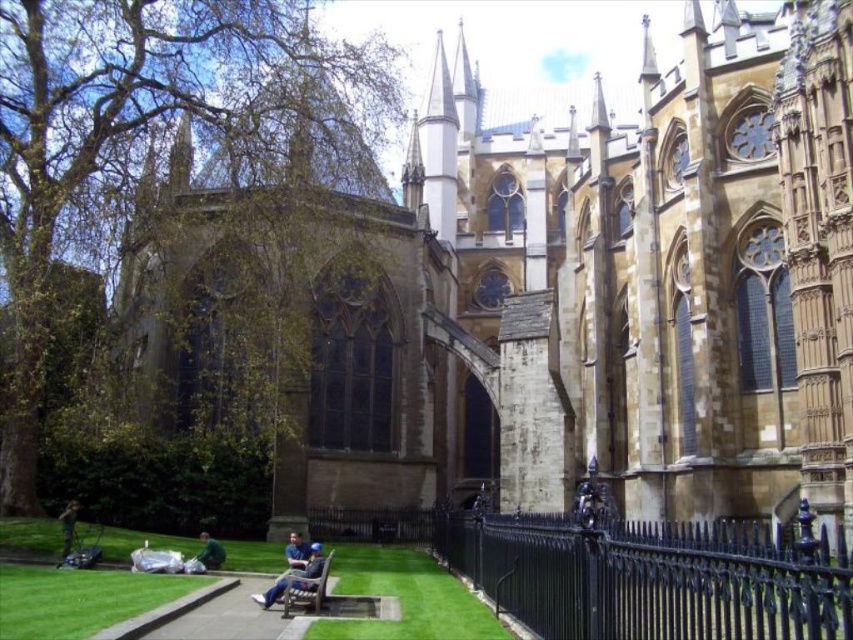
You are a visitor standing at the entrance of the historic Gothic building and want to take a photo of the black wrought iron fence at lower right and the wooden bench at center. Which object is taller in the image?

The black wrought iron fence at lower right is taller than the wooden bench at center.

You are standing at the entrance of the historic Gothic building and want to sit down to rest. You see the black wrought iron fence at lower right and the dark green jacket at lower left. Which object is closer to you?

The dark green jacket at lower left is closer because the black wrought iron fence at lower right is positioned under it, indicating the jacket is in front.